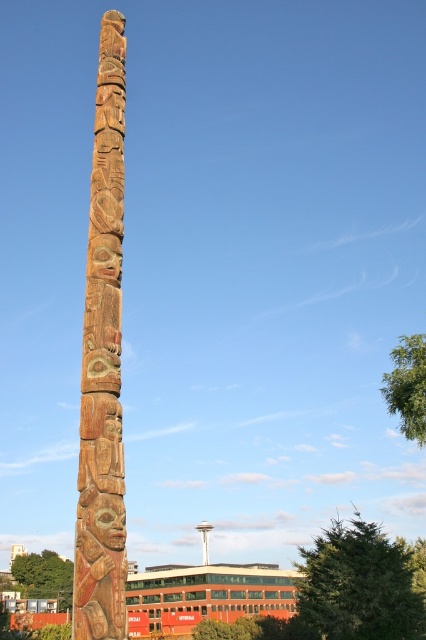
Question: Which point is farther from the camera taking this photo?

Choices:
 (A) (55, 588)
 (B) (371, 589)

Answer: (A)

Question: Which point is farther from the camera taking this photo?

Choices:
 (A) (397, 400)
 (B) (89, 262)
 (C) (60, 573)

Answer: (C)

Question: Based on their relative distances, which object is farther from the green textured tree at lower right?

Choices:
 (A) wooden totem pole at center
 (B) green leafy tree at lower left
 (C) green leafy tree at upper right

Answer: (B)

Question: Is wooden totem pole at center in front of green textured tree at lower right?

Choices:
 (A) yes
 (B) no

Answer: (A)

Question: Does green leafy tree at upper right appear over green leafy tree at lower left?

Choices:
 (A) no
 (B) yes

Answer: (B)

Question: Can you confirm if wooden totem pole at center is thinner than green leafy tree at lower left?

Choices:
 (A) no
 (B) yes

Answer: (B)